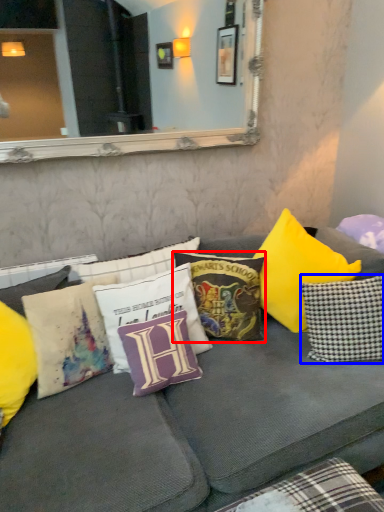
Question: Which object appears closest to the camera in this image, pillow (highlighted by a red box) or pillow (highlighted by a blue box)?

Choices:
 (A) pillow
 (B) pillow

Answer: (B)